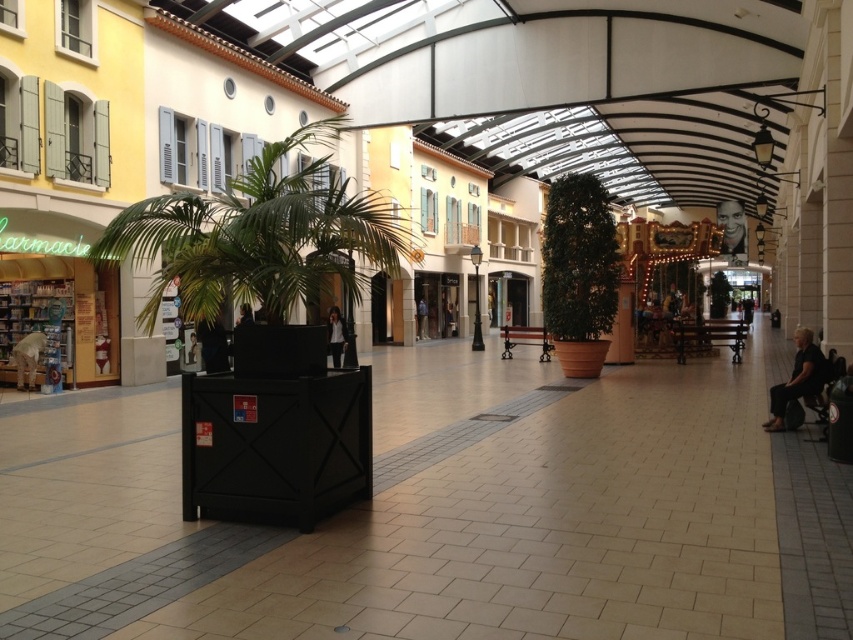
What do you see at coordinates (798, 380) in the screenshot? I see `black fabric chair at lower right` at bounding box center [798, 380].

Between black fabric chair at lower right and smooth skin face at upper right, which one has less height?

black fabric chair at lower right

What do you see at coordinates (798, 380) in the screenshot? I see `black fabric chair at lower right` at bounding box center [798, 380].

I want to click on black fabric chair at lower right, so click(798, 380).

Identify the location of white shirt at center. The image size is (853, 640). (335, 336).

Which is more to the left, black fabric chair at lower right or blue denim jacket at center?

Positioned to the left is blue denim jacket at center.

Can you confirm if black fabric chair at lower right is bigger than blue denim jacket at center?

No.

I want to click on black fabric chair at lower right, so click(x=798, y=380).

This screenshot has width=853, height=640. I want to click on black fabric chair at lower right, so [x=798, y=380].